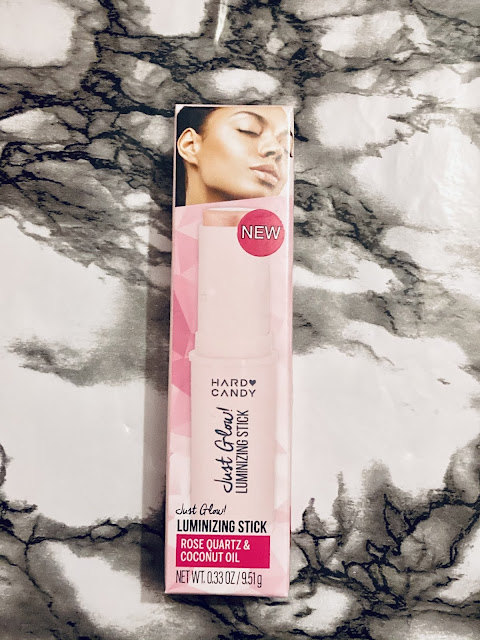
I want to click on black, white, grey marbled table, so click(346, 340).